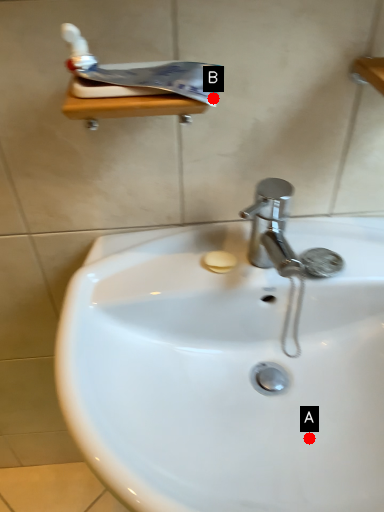
Question: Two points are circled on the image, labeled by A and B beside each circle. Which point is further to the camera?

Choices:
 (A) A is further
 (B) B is further

Answer: (A)